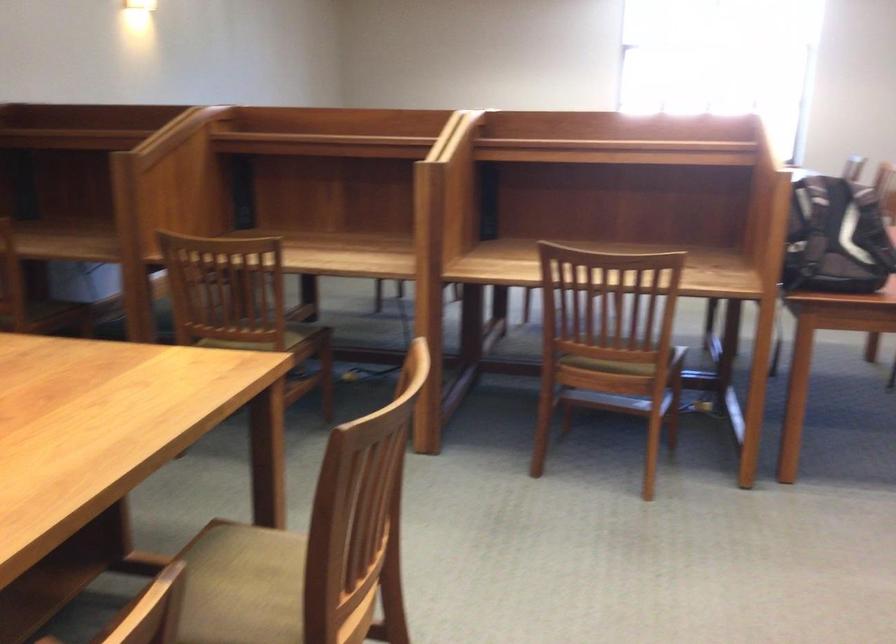
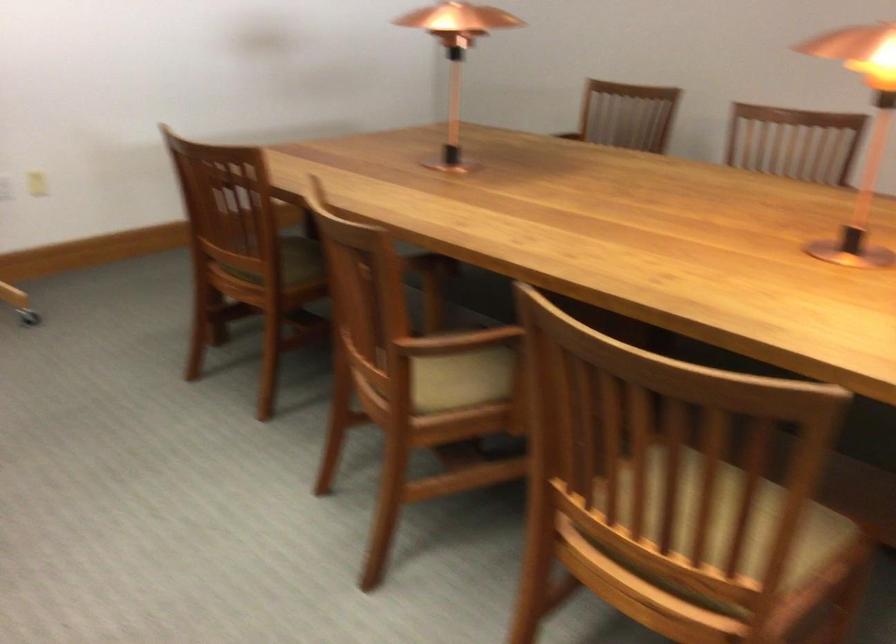
The point at (382, 489) is marked in the first image. Where is the corresponding point in the second image?

(728, 526)